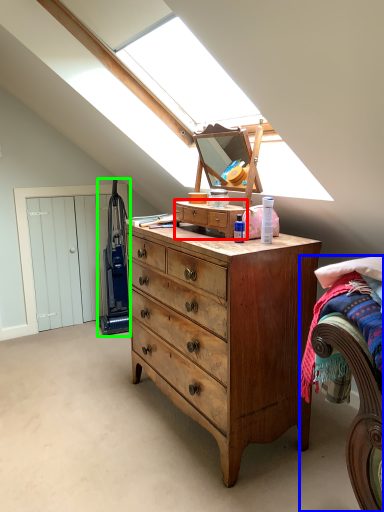
Question: Which object is positioned closest to cabinetry (highlighted by a red box)? Select from bed (highlighted by a blue box) and equipment (highlighted by a green box).

Choices:
 (A) bed
 (B) equipment

Answer: (A)